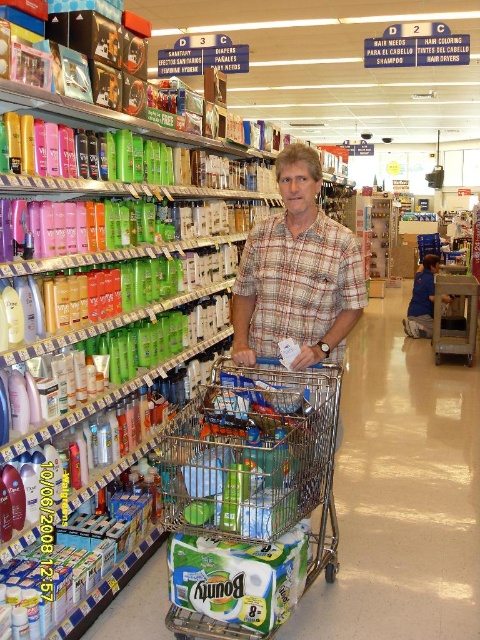
You are standing in the grocery store and see the metallic silver trolley at center. If you want to reach it without moving your feet, can you do so?

The metallic silver trolley at center is 6.01 feet from viewer, so you cannot reach it without moving your feet since it is too far away.

You are standing in the grocery store and want to pick up an item from the shelf. The item is located at point (164, 484), and another item is at point (423, 314). Which item will be easier to reach without moving your position?

The item at point (164, 484) will be easier to reach because it is closer to you compared to the item at point (423, 314).

You are standing in the grocery store and see the metallic silver shopping cart at center and the plaid cotton shirt at center. Which object is shorter?

The metallic silver shopping cart at center is shorter than the plaid cotton shirt at center.